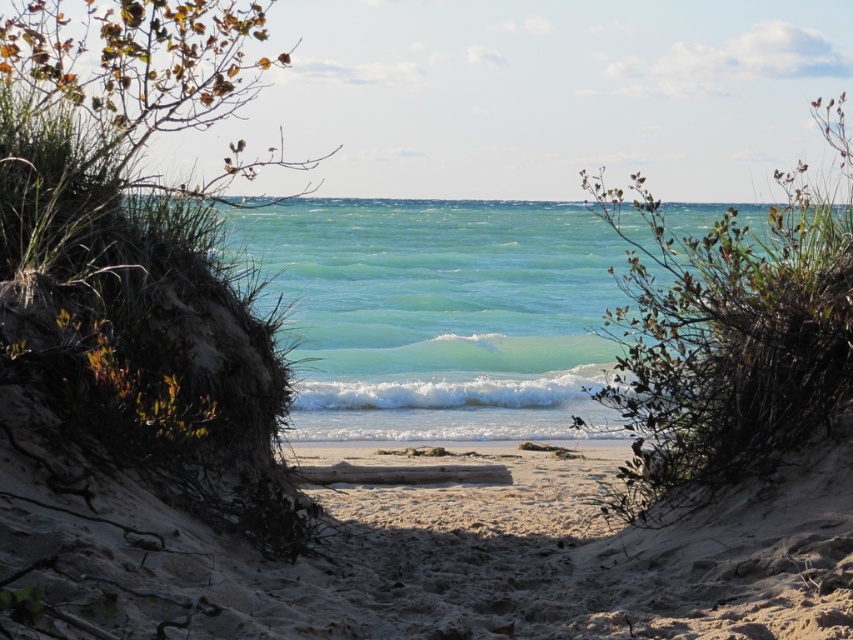
Question: Is translucent teal water at center smaller than white sandy beach at center?

Choices:
 (A) no
 (B) yes

Answer: (A)

Question: Does translucent teal water at center appear on the left side of white sandy beach at center?

Choices:
 (A) no
 (B) yes

Answer: (A)

Question: Observing the image, what is the correct spatial positioning of translucent teal water at center in reference to white sandy beach at center?

Choices:
 (A) below
 (B) above

Answer: (B)

Question: Among these objects, which one is nearest to the camera?

Choices:
 (A) white sandy beach at center
 (B) translucent teal water at center

Answer: (B)